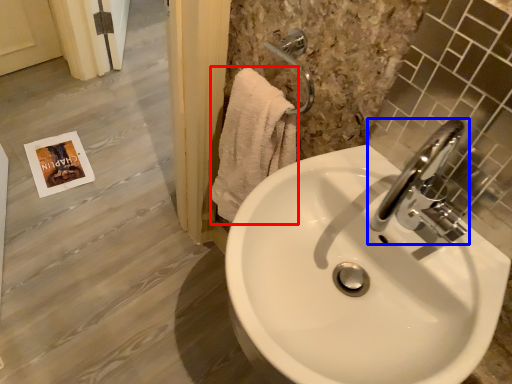
Question: Which point is closer to the camera, bath towel (highlighted by a red box) or tap (highlighted by a blue box)?

Choices:
 (A) bath towel
 (B) tap

Answer: (B)